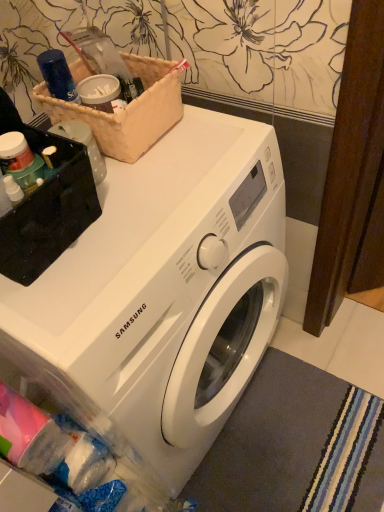
I want to click on free space above gray soft carpet at lower right (from a real-world perspective), so click(294, 445).